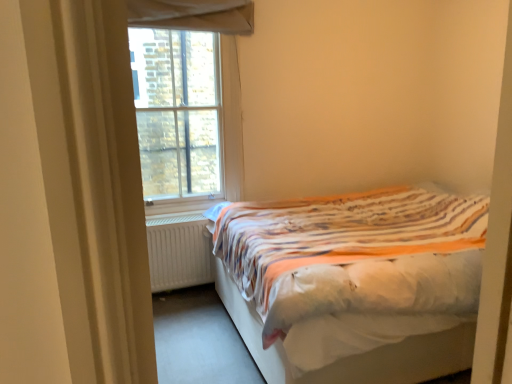
Question: From a real-world perspective, is white fabric bed at right located beneath white matte radiator at lower left?

Choices:
 (A) yes
 (B) no

Answer: (B)

Question: Is white fabric bed at right looking in the opposite direction of white matte radiator at lower left?

Choices:
 (A) no
 (B) yes

Answer: (A)

Question: Is white fabric bed at right surrounding white matte radiator at lower left?

Choices:
 (A) no
 (B) yes

Answer: (A)

Question: Can you confirm if white fabric bed at right is smaller than white matte radiator at lower left?

Choices:
 (A) yes
 (B) no

Answer: (B)

Question: Is white fabric bed at right directly adjacent to white matte radiator at lower left?

Choices:
 (A) yes
 (B) no

Answer: (B)

Question: Is white fabric bed at right positioned beyond the bounds of white matte radiator at lower left?

Choices:
 (A) yes
 (B) no

Answer: (A)

Question: From the image's perspective, is white fabric bed at right under clear glass window at upper left?

Choices:
 (A) no
 (B) yes

Answer: (B)

Question: Is white fabric bed at right aimed at clear glass window at upper left?

Choices:
 (A) no
 (B) yes

Answer: (A)

Question: Could clear glass window at upper left be considered to be inside white fabric bed at right?

Choices:
 (A) yes
 (B) no

Answer: (B)

Question: From a real-world perspective, does white fabric bed at right stand above clear glass window at upper left?

Choices:
 (A) no
 (B) yes

Answer: (A)

Question: Is white fabric bed at right bigger than clear glass window at upper left?

Choices:
 (A) yes
 (B) no

Answer: (A)

Question: From a real-world perspective, is white fabric bed at right beneath clear glass window at upper left?

Choices:
 (A) no
 (B) yes

Answer: (B)

Question: Is white matte radiator at lower left taller than clear glass window at upper left?

Choices:
 (A) yes
 (B) no

Answer: (B)